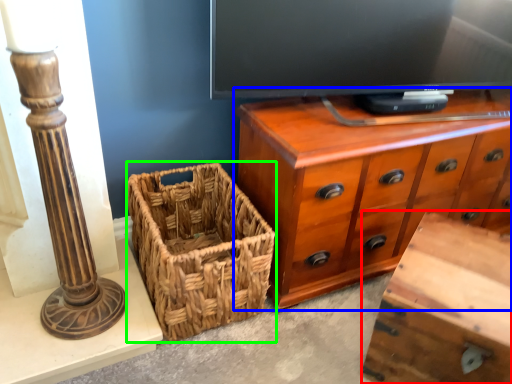
Question: Which is nearer to the vanity (highlighted by a red box)? chest of drawers (highlighted by a blue box) or picnic basket (highlighted by a green box).

Choices:
 (A) chest of drawers
 (B) picnic basket

Answer: (A)